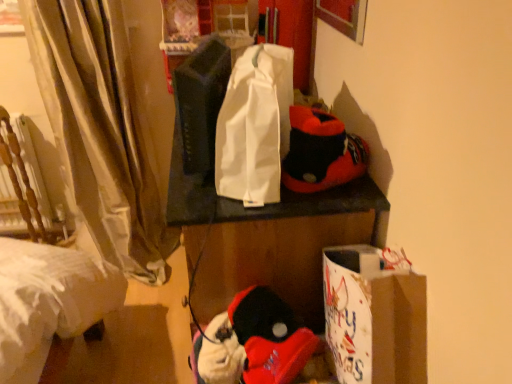
The width and height of the screenshot is (512, 384). What do you see at coordinates (321, 152) in the screenshot?
I see `soft plush slippers at upper right, the first twin when ordered from right to left` at bounding box center [321, 152].

What do you see at coordinates (23, 186) in the screenshot?
I see `wooden armchair at left` at bounding box center [23, 186].

What do you see at coordinates (221, 361) in the screenshot? I see `fluffy white plush at lower center, arranged as the first toy when viewed from the left` at bounding box center [221, 361].

Where is `soft plush slippers at upper right, acting as the second twin starting from the left`? The width and height of the screenshot is (512, 384). soft plush slippers at upper right, acting as the second twin starting from the left is located at coordinates (321, 152).

Measure the distance from white paper bag at lower right to white fabric tote bag at center.

white paper bag at lower right and white fabric tote bag at center are 14.70 inches apart.

Can you confirm if white paper bag at lower right is taller than white fabric tote bag at center?

No.

From a real-world perspective, which object stands above the other?

In real-world perspective, white fabric tote bag at center is above.

Does point (426, 293) appear closer or farther from the camera than point (248, 63)?

Point (426, 293) is closer to the camera than point (248, 63).

Locate an element on the screen. armchair positioned vertically above the fluffy white plush at lower center, placed as the 2th toy when sorted from right to left (from a real-world perspective) is located at coordinates (23, 186).

Which is more to the left, wooden armchair at left or fluffy white plush at lower center, arranged as the first toy when viewed from the left?

From the viewer's perspective, wooden armchair at left appears more on the left side.

Can you tell me how much wooden armchair at left and fluffy white plush at lower center, placed as the 2th toy when sorted from right to left, differ in facing direction?

The angle between the facing direction of wooden armchair at left and the facing direction of fluffy white plush at lower center, placed as the 2th toy when sorted from right to left, is 91.5 degrees.

Do you think soft plush slippers at upper right, the first twin when ordered from right to left, is within white fabric tote bag at center, or outside of it?

soft plush slippers at upper right, the first twin when ordered from right to left, is outside white fabric tote bag at center.

From a real-world perspective, is soft plush slippers at upper right, acting as the second twin starting from the left, above or below white fabric tote bag at center?

In terms of real-world spatial position, soft plush slippers at upper right, acting as the second twin starting from the left, is below white fabric tote bag at center.

Is soft plush slippers at upper right, acting as the second twin starting from the left, facing towards white fabric tote bag at center?

Yes, soft plush slippers at upper right, acting as the second twin starting from the left, is turned towards white fabric tote bag at center.

Considering the relative positions of soft plush slippers at upper right, acting as the second twin starting from the left, and white fabric tote bag at center in the image provided, is soft plush slippers at upper right, acting as the second twin starting from the left, to the right of white fabric tote bag at center from the viewer's perspective?

Correct, you'll find soft plush slippers at upper right, acting as the second twin starting from the left, to the right of white fabric tote bag at center.

From a real-world perspective, which object rests below the other?

fluffy white plush at lower center, placed as the 2th toy when sorted from right to left, from a real-world perspective.

Is soft plush toy at lower center, the second toy when ordered from left to right, facing towards fluffy white plush at lower center, placed as the 2th toy when sorted from right to left?

Yes, soft plush toy at lower center, the second toy when ordered from left to right, is aimed at fluffy white plush at lower center, placed as the 2th toy when sorted from right to left.

Is point (262, 340) less distant than point (234, 347)?

Yes, point (262, 340) is in front of point (234, 347).

In the scene shown: How different are the orientations of wooden armchair at left and soft plush slippers at upper right, the first twin when ordered from right to left, in degrees?

The facing directions of wooden armchair at left and soft plush slippers at upper right, the first twin when ordered from right to left, are 91.5 degrees apart.

Which is more to the right, wooden armchair at left or soft plush slippers at upper right, the first twin when ordered from right to left?

From the viewer's perspective, soft plush slippers at upper right, the first twin when ordered from right to left, appears more on the right side.

Does point (45, 237) lie behind point (331, 172)?

Yes, point (45, 237) is behind point (331, 172).

Considering the relative sizes of wooden armchair at left and soft plush slippers at upper right, acting as the second twin starting from the left, in the image provided, is wooden armchair at left smaller than soft plush slippers at upper right, acting as the second twin starting from the left,?

Actually, wooden armchair at left might be larger than soft plush slippers at upper right, acting as the second twin starting from the left.

From a real-world perspective, is soft plush toy at lower center, which is the first toy in right-to-left order, above or below wooden armchair at left?

Clearly, from a real-world perspective, soft plush toy at lower center, which is the first toy in right-to-left order, is above wooden armchair at left.

Find the location of a particular element. This screenshot has width=512, height=384. the 1st toy positioned below the wooden armchair at left (from the image's perspective) is located at coordinates [x=253, y=342].

Is soft plush toy at lower center, which is the first toy in right-to-left order, oriented away from wooden armchair at left?

No, wooden armchair at left is not at the back of soft plush toy at lower center, which is the first toy in right-to-left order.

Is the position of soft plush toy at lower center, the second toy when ordered from left to right, less distant than that of wooden armchair at left?

Yes, the depth of soft plush toy at lower center, the second toy when ordered from left to right, is less than that of wooden armchair at left.

Looking at the image, does soft plush toy at lower center, which is the first toy in right-to-left order, seem bigger or smaller compared to white paper bag at lower right?

Clearly, soft plush toy at lower center, which is the first toy in right-to-left order, is smaller in size than white paper bag at lower right.

Does soft plush toy at lower center, which is the first toy in right-to-left order, have a greater height compared to white paper bag at lower right?

In fact, soft plush toy at lower center, which is the first toy in right-to-left order, may be shorter than white paper bag at lower right.

Identify the location of cardboard box located above the soft plush toy at lower center, the second toy when ordered from left to right (from a real-world perspective). (374, 318).

Between point (264, 348) and point (371, 307), which one is positioned in front?

The point (371, 307) is more forward.

Identify the location of tote bag that is above the white paper bag at lower right (from a real-world perspective). Image resolution: width=512 pixels, height=384 pixels. (255, 126).

In order to click on armchair on the left of fluffy white plush at lower center, arranged as the first toy when viewed from the left in this screenshot , I will do click(x=23, y=186).

Based on their spatial positions, is white fabric tote bag at center or soft plush toy at lower center, the second toy when ordered from left to right, closer to silky beige curtain at left?

Based on the image, white fabric tote bag at center appears to be nearer to silky beige curtain at left.

From the image, which object appears to be nearer to soft plush toy at lower center, which is the first toy in right-to-left order, matte black speaker at center, marked as the first twin in a left-to-right arrangement, or wooden armchair at left?

matte black speaker at center, marked as the first twin in a left-to-right arrangement, lies closer to soft plush toy at lower center, which is the first toy in right-to-left order, than the other object.

Looking at the image, which one is located closer to white paper bag at lower right, white fabric tote bag at center or silky beige curtain at left?

white fabric tote bag at center.

From the image, which object appears to be nearer to fluffy white plush at lower center, placed as the 2th toy when sorted from right to left, soft plush toy at lower center, the second toy when ordered from left to right, or white fabric tote bag at center?

Among the two, soft plush toy at lower center, the second toy when ordered from left to right, is located nearer to fluffy white plush at lower center, placed as the 2th toy when sorted from right to left.

From the image, which object appears to be nearer to fluffy white plush at lower center, arranged as the first toy when viewed from the left, white paper bag at lower right or wooden armchair at left?

white paper bag at lower right is closer to fluffy white plush at lower center, arranged as the first toy when viewed from the left.

When comparing their distances from white paper bag at lower right, does white fabric tote bag at center or soft plush toy at lower center, which is the first toy in right-to-left order, seem closer?

Among the two, soft plush toy at lower center, which is the first toy in right-to-left order, is located nearer to white paper bag at lower right.

Considering their positions, is soft plush toy at lower center, the second toy when ordered from left to right, positioned closer to silky beige curtain at left than soft plush slippers at upper right, the first twin when ordered from right to left?

Among the two, soft plush toy at lower center, the second toy when ordered from left to right, is located nearer to silky beige curtain at left.

When comparing their distances from white paper bag at lower right, does soft plush toy at lower center, the second toy when ordered from left to right, or soft plush slippers at upper right, acting as the second twin starting from the left, seem closer?

soft plush toy at lower center, the second toy when ordered from left to right.

You are a GUI agent. You are given a task and a screenshot of the screen. Output one action in this format:
    pyautogui.click(x=<x>, y=<y>)
    Task: Click on the curtain between wooden armchair at left and soft plush toy at lower center, the second toy when ordered from left to right, from left to right
    The width and height of the screenshot is (512, 384).
    Given the screenshot: What is the action you would take?
    (101, 130)

The image size is (512, 384). In order to click on toy situated between wooden armchair at left and soft plush toy at lower center, which is the first toy in right-to-left order, from left to right in this screenshot , I will do `click(221, 361)`.

Locate an element on the screen. twin located between wooden armchair at left and fluffy white plush at lower center, arranged as the first toy when viewed from the left, in the left-right direction is located at coordinates (201, 102).

This screenshot has width=512, height=384. Find the location of `twin between matte black speaker at center, arranged as the 2th twin when viewed from the right, and white paper bag at lower right in the up-down direction`. twin between matte black speaker at center, arranged as the 2th twin when viewed from the right, and white paper bag at lower right in the up-down direction is located at coordinates (321, 152).